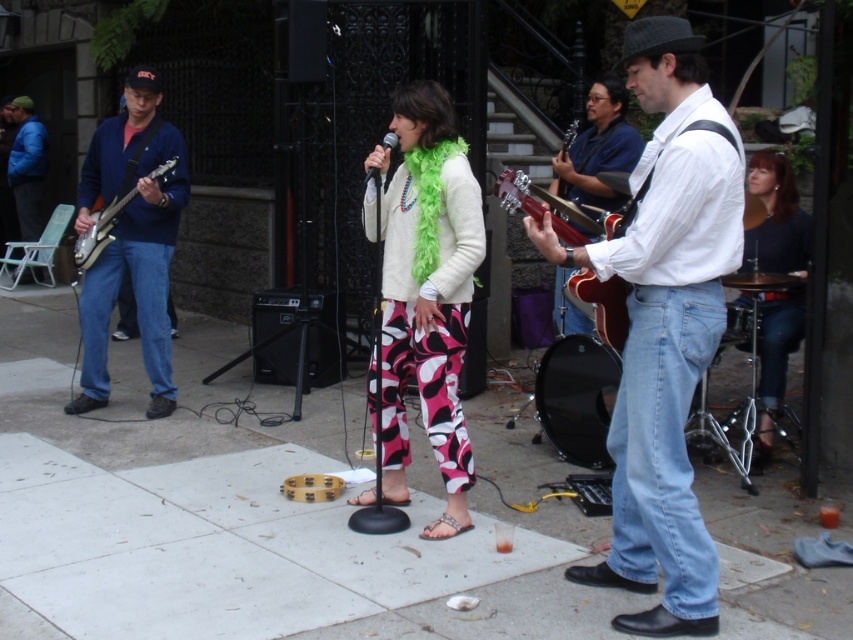
You are a photographer trying to capture a clear shot of the white shirt at center and the shiny black electric guitar at left. Which object should you focus on first if you want to ensure both are in focus?

A: The white shirt at center is positioned under shiny black electric guitar at left, so you should focus on the shiny black electric guitar at left first to ensure both are in focus.

You are a photographer trying to capture the performers. You notice the shiny brown guitar at center and the blue denim jacket at left. Which object is positioned to the right of the other?

The shiny brown guitar at center is to the right of the blue denim jacket at left.